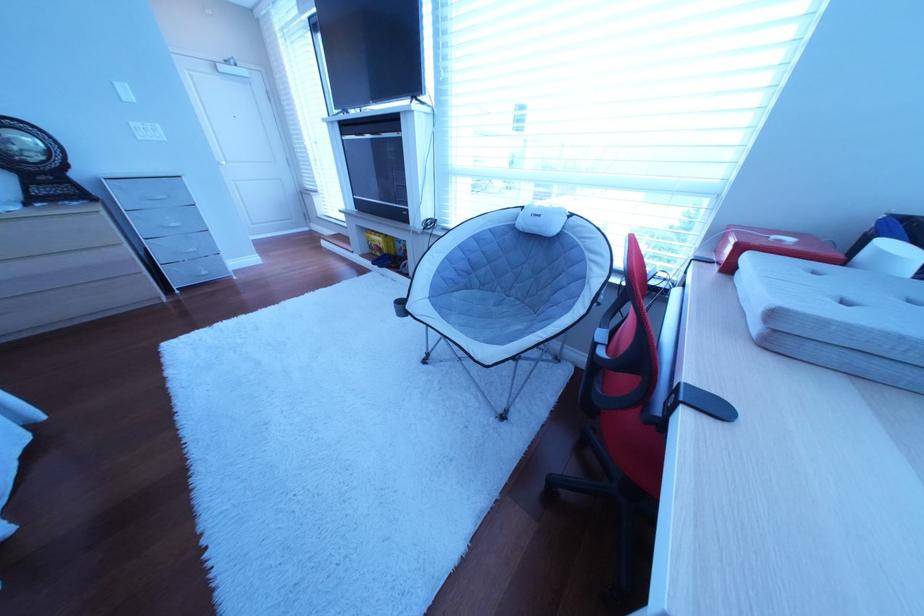
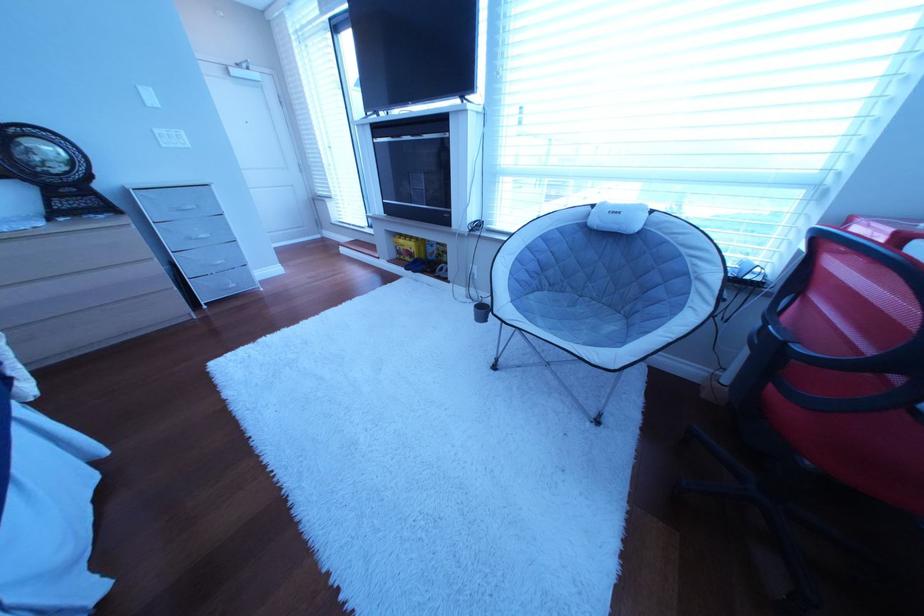
Where in the second image is the point corresponding to point (388, 246) from the first image?

(418, 251)